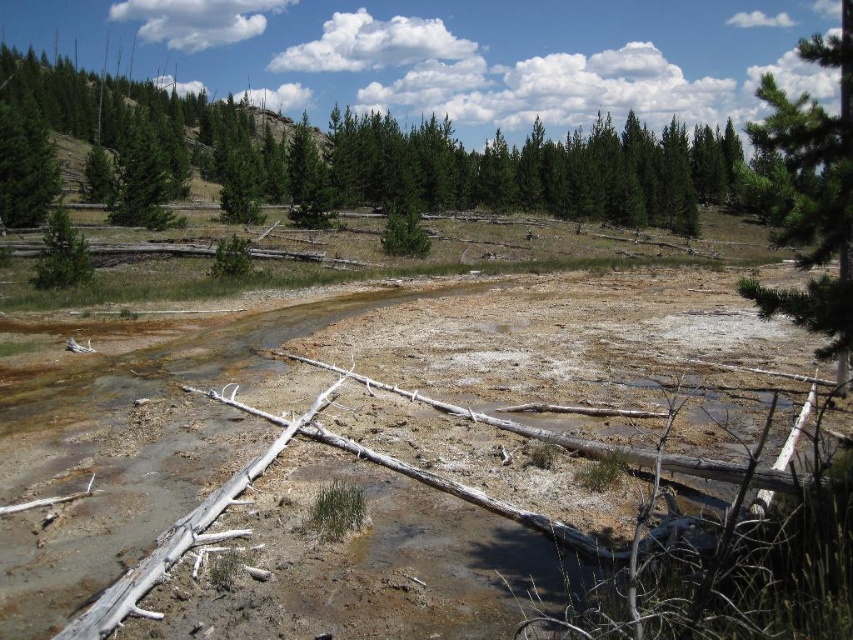
Question: Considering the real-world distances, which object is farthest from the brown clayey mud at center?

Choices:
 (A) green matte tree at left
 (B) green matte tree at upper center

Answer: (B)

Question: Does green matte tree at upper center have a lesser width compared to green textured pine tree at upper right?

Choices:
 (A) yes
 (B) no

Answer: (B)

Question: Does green matte tree at upper center appear over green matte tree at left?

Choices:
 (A) yes
 (B) no

Answer: (A)

Question: Which point is closer to the camera?

Choices:
 (A) (473, 374)
 (B) (831, 244)
 (C) (344, 120)

Answer: (B)

Question: Which point is farther from the camera taking this photo?

Choices:
 (A) (445, 132)
 (B) (846, 317)

Answer: (A)

Question: Can you confirm if green textured pine tree at upper right is positioned above green matte tree at left?

Choices:
 (A) yes
 (B) no

Answer: (A)